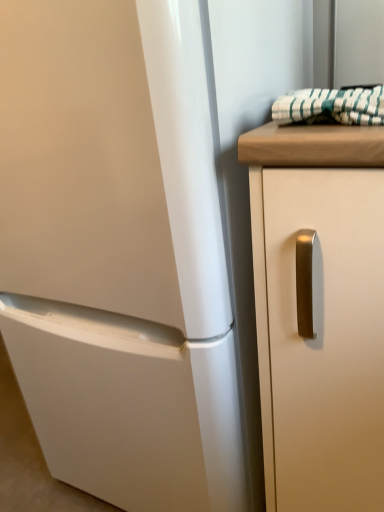
Question: From a real-world perspective, is green striped fabric at upper right above or below white matte cabinet handle at right?

Choices:
 (A) below
 (B) above

Answer: (B)

Question: Based on their sizes in the image, would you say green striped fabric at upper right is bigger or smaller than white matte cabinet handle at right?

Choices:
 (A) big
 (B) small

Answer: (B)

Question: Is green striped fabric at upper right situated inside white matte cabinet handle at right or outside?

Choices:
 (A) outside
 (B) inside

Answer: (A)

Question: Considering the positions of point (248, 141) and point (322, 117), is point (248, 141) closer or farther from the camera than point (322, 117)?

Choices:
 (A) farther
 (B) closer

Answer: (B)

Question: Considering the positions of white matte cabinet handle at right and green striped fabric at upper right in the image, is white matte cabinet handle at right taller or shorter than green striped fabric at upper right?

Choices:
 (A) tall
 (B) short

Answer: (A)

Question: In the image, is white matte cabinet handle at right on the left side or the right side of green striped fabric at upper right?

Choices:
 (A) left
 (B) right

Answer: (B)

Question: From a real-world perspective, is white matte cabinet handle at right physically located above or below green striped fabric at upper right?

Choices:
 (A) above
 (B) below

Answer: (B)